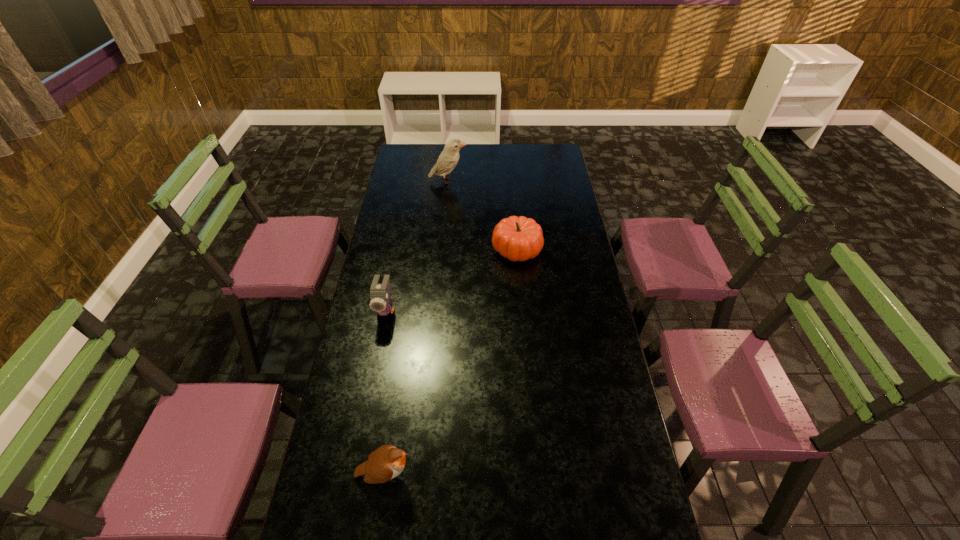
In order to click on vacant space at the far edge of the desktop in this screenshot , I will do (480, 165).

The image size is (960, 540). In the image, there is a desktop. Identify the location of blank space at the left edge. (401, 193).

Identify the location of free space at the right edge of the desktop. (588, 484).

Locate an element on the screen. free spot between the nearest object and the tallest bird is located at coordinates (417, 328).

At what (x,y) coordinates should I click in order to perform the action: click on free space between the pumpkin and the nearest bird. Please return your answer as a coordinate pair (x, y). The image size is (960, 540). Looking at the image, I should click on (451, 362).

Where is `blank region between the second nearest bird and the nearest object`? This screenshot has width=960, height=540. blank region between the second nearest bird and the nearest object is located at coordinates (386, 392).

This screenshot has width=960, height=540. What are the coordinates of `blank region between the tallest object and the third nearest object` in the screenshot? It's located at (482, 215).

Locate an element on the screen. This screenshot has height=540, width=960. free space that is in between the second farthest bird and the tallest object is located at coordinates (417, 245).

In order to click on empty space between the tallest bird and the nearest object in this screenshot , I will do `click(417, 328)`.

Where is `free area in between the tallest object and the second farthest object`? free area in between the tallest object and the second farthest object is located at coordinates (482, 215).